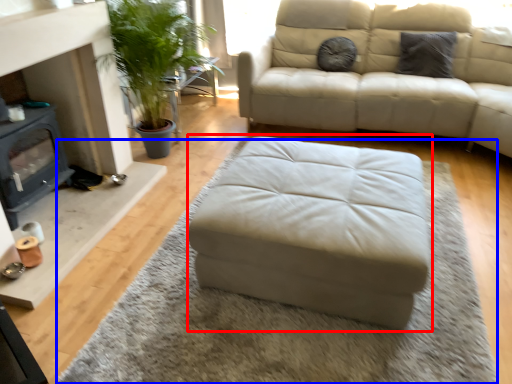
Question: Which object appears farthest to the camera in this image, stool (highlighted by a red box) or mat (highlighted by a blue box)?

Choices:
 (A) stool
 (B) mat

Answer: (A)